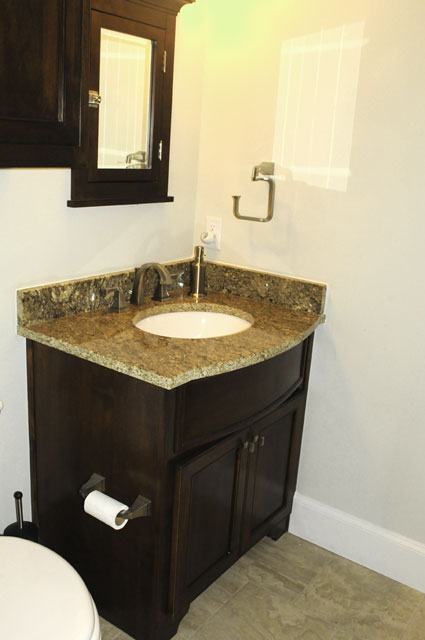
In order to click on hinge in this screenshot , I will do `click(161, 150)`, `click(165, 61)`.